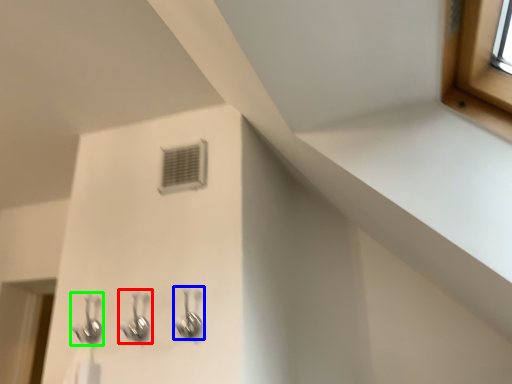
Question: Which is nearer to the plumbing fixture (highlighted by a red box)? plumbing fixture (highlighted by a blue box) or plumbing fixture (highlighted by a green box).

Choices:
 (A) plumbing fixture
 (B) plumbing fixture

Answer: (B)